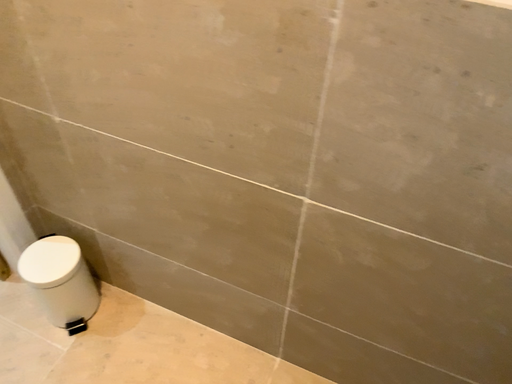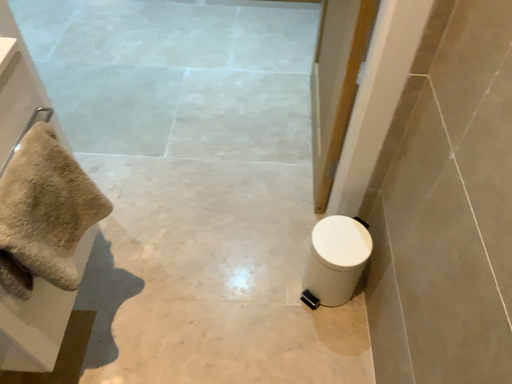
Question: Which way did the camera rotate in the video?

Choices:
 (A) rotated left
 (B) rotated right

Answer: (A)